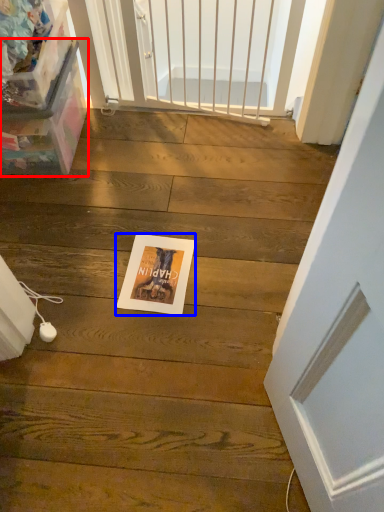
Question: Which of the following is the farthest to the observer, box (highlighted by a red box) or postcard (highlighted by a blue box)?

Choices:
 (A) box
 (B) postcard

Answer: (B)